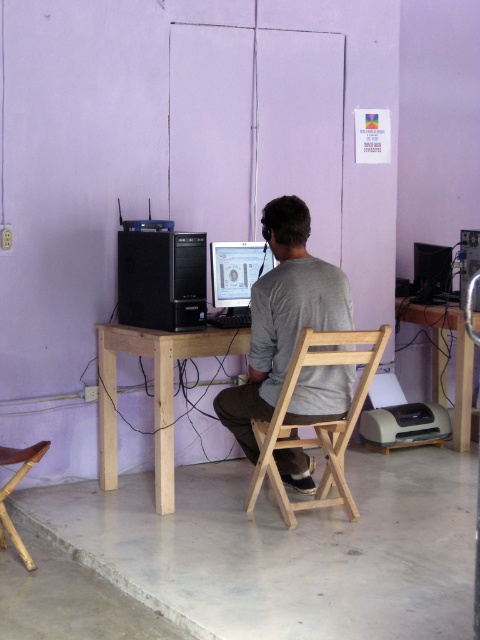
Question: Which of the following is the closest to the observer?

Choices:
 (A) (105, 481)
 (B) (233, 305)

Answer: (A)

Question: Does black plastic computer tower at center appear over matte black computer desk at lower right?

Choices:
 (A) yes
 (B) no

Answer: (A)

Question: Can you confirm if light wood table at center is positioned below matte black monitor at right?

Choices:
 (A) yes
 (B) no

Answer: (A)

Question: Among these objects, which one is farthest from the camera?

Choices:
 (A) matte black monitor at right
 (B) gray cotton shirt at center

Answer: (A)

Question: Does light wood folding chair at center appear under light wood table at center?

Choices:
 (A) yes
 (B) no

Answer: (A)

Question: Which object appears closest to the camera in this image?

Choices:
 (A) matte black monitor at right
 (B) light wood table at center
 (C) black plastic computer tower at center

Answer: (B)